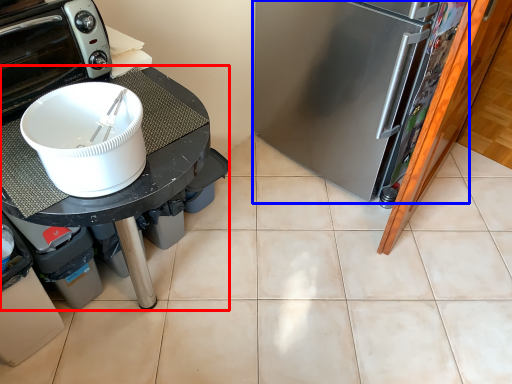
Question: Which object is closer to the camera taking this photo, table (highlighted by a red box) or refrigerator (highlighted by a blue box)?

Choices:
 (A) table
 (B) refrigerator

Answer: (A)